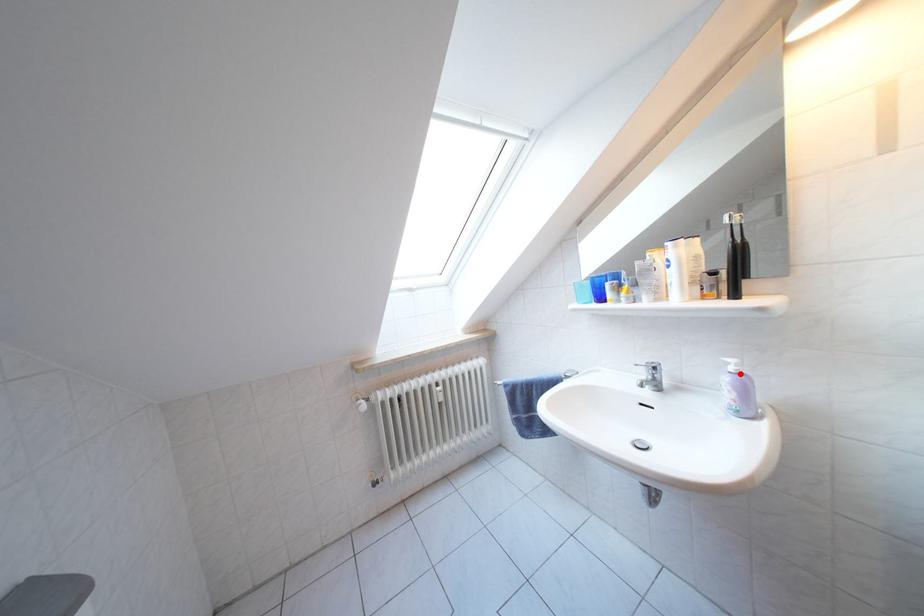
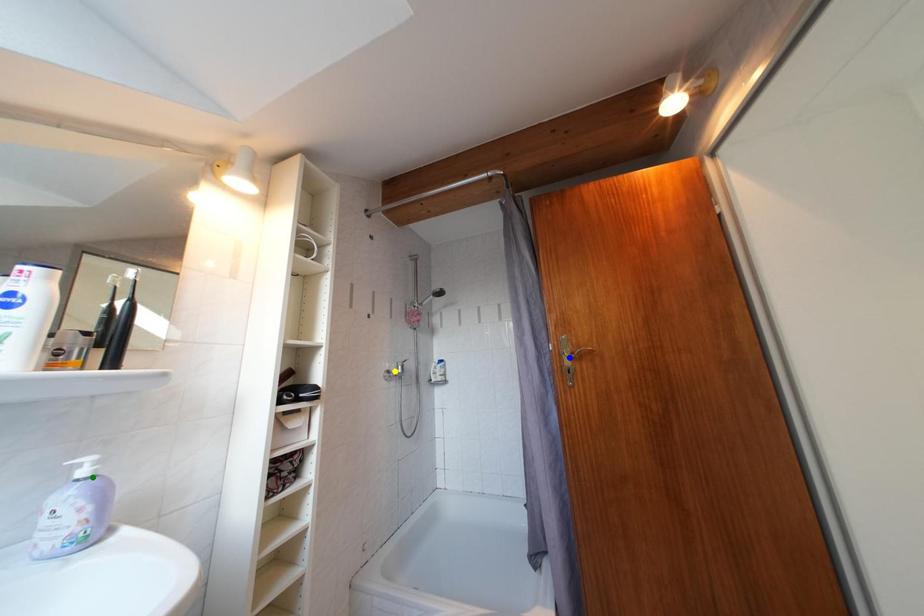
Question: I am providing you with two images of the same scene from different viewpoints. A red point is marked on the first image. You are given multiple points on the second image. Which point in image 2 represents the same 3d spot as the red point in image 1?

Choices:
 (A) yellow point
 (B) blue point
 (C) green point

Answer: (C)